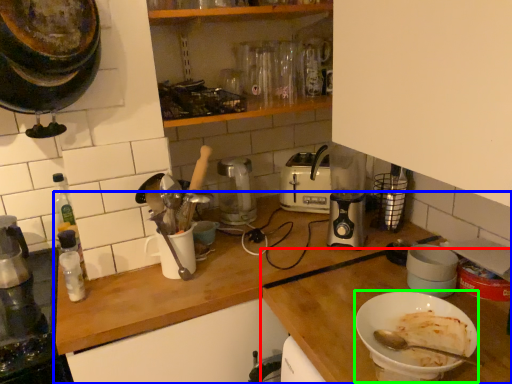
Question: Which object is the closest to the countertop (highlighted by a red box)? Choose among these: countertop (highlighted by a blue box) or bowl (highlighted by a green box).

Choices:
 (A) countertop
 (B) bowl

Answer: (A)